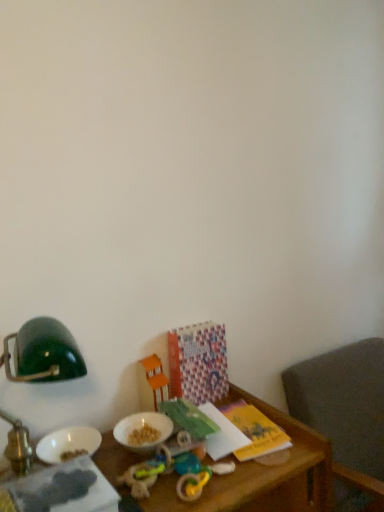
In order to click on free space in front of rubber chew toy at lower center, acting as the second toy starting from the back in this screenshot , I will do `click(155, 501)`.